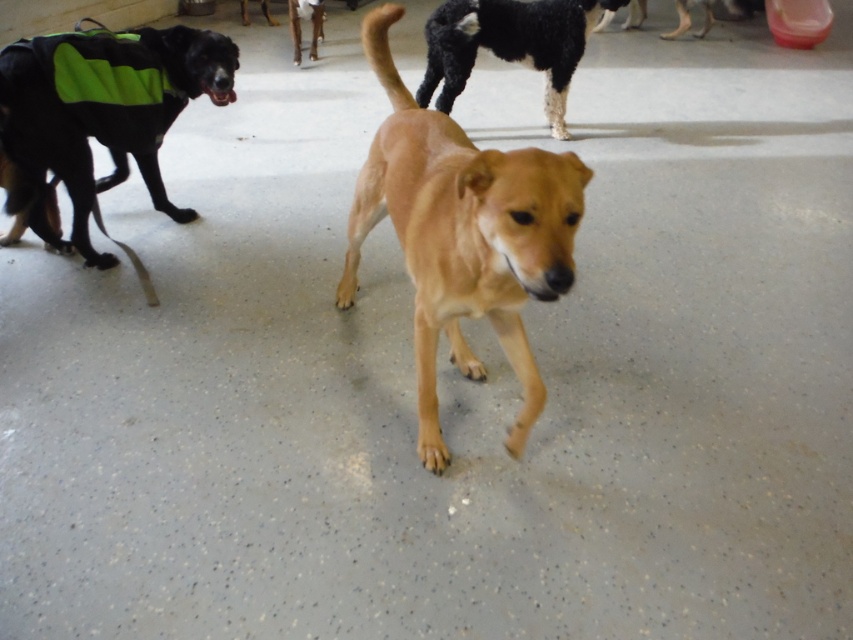
Which is behind, point (405, 241) or point (53, 244)?

Positioned behind is point (53, 244).

Can you confirm if golden fur dog at center is positioned to the left of green reflective vest at left?

Incorrect, golden fur dog at center is not on the left side of green reflective vest at left.

Is point (390, 195) closer to camera compared to point (117, 52)?

Yes, it is.

Where is `golden fur dog at center`? golden fur dog at center is located at coordinates (462, 236).

Which is above, black fuzzy dog at upper center or brown matte dog at center?

brown matte dog at center

Who is shorter, black fuzzy dog at upper center or brown matte dog at center?

Standing shorter between the two is brown matte dog at center.

Does point (560, 58) come behind point (308, 16)?

No.

Find the location of a particular element. The height and width of the screenshot is (640, 853). black fuzzy dog at upper center is located at coordinates (509, 45).

Is point (88, 88) closer to camera compared to point (525, 60)?

Yes, it is in front of point (525, 60).

Who is more forward, (42, 84) or (440, 65)?

Point (42, 84) is in front.

Identify the location of green reflective vest at left. Image resolution: width=853 pixels, height=640 pixels. (102, 109).